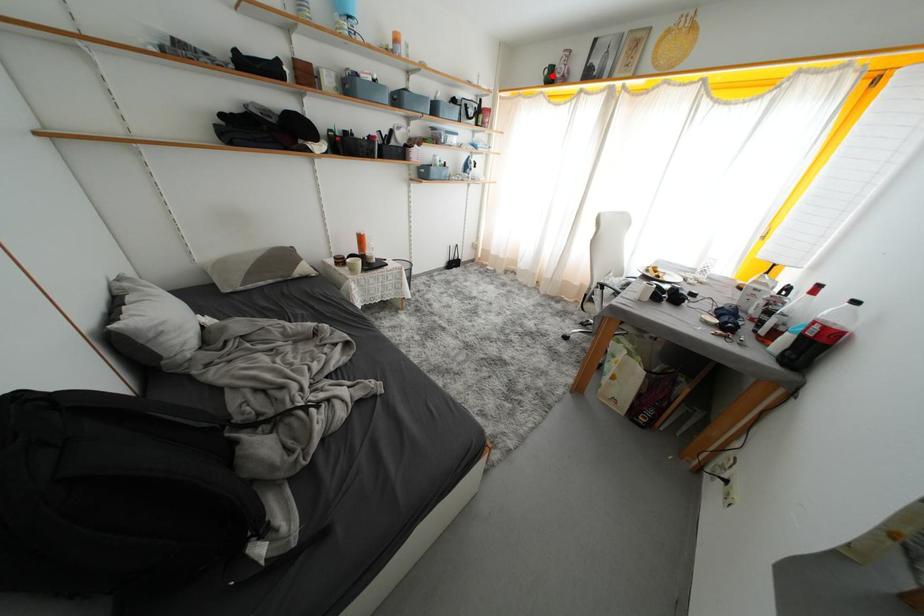
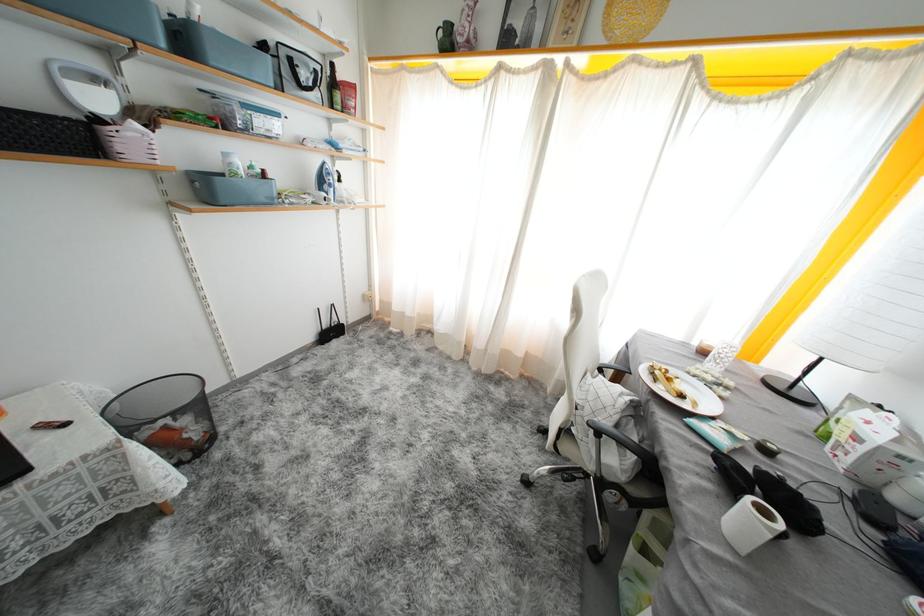
In the second image, find the point that corresponds to the highlighted location in the first image.

(446, 37)